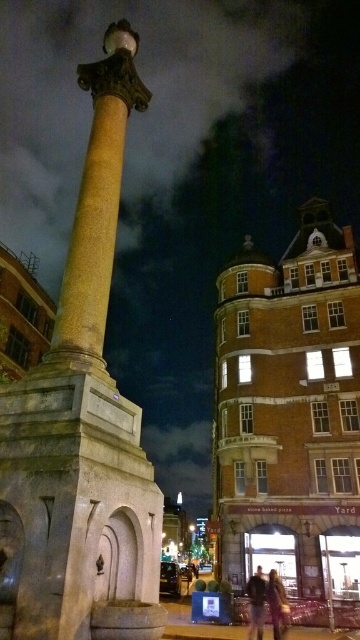
Question: Is marble column at center to the right of leather jacket at center from the viewer's perspective?

Choices:
 (A) no
 (B) yes

Answer: (A)

Question: Which point is closer to the camera?

Choices:
 (A) leather jacket at center
 (B) dark brown leather jacket at lower center
 (C) marble column at center

Answer: (C)

Question: Can you confirm if leather jacket at center is wider than dark brown leather jacket at lower center?

Choices:
 (A) yes
 (B) no

Answer: (B)

Question: Which point is closer to the camera?

Choices:
 (A) (117, 397)
 (B) (264, 593)
 (C) (281, 625)

Answer: (A)

Question: Estimate the real-world distances between objects in this image. Which object is closer to the marble column at center?

Choices:
 (A) dark brown leather jacket at lower center
 (B) leather jacket at center

Answer: (B)

Question: Can you confirm if leather jacket at center is wider than dark brown leather jacket at lower center?

Choices:
 (A) yes
 (B) no

Answer: (B)